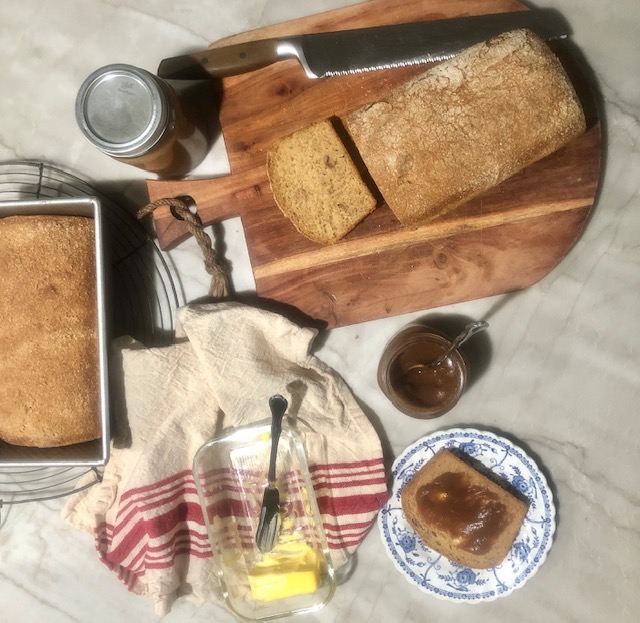
This screenshot has height=623, width=640. I want to click on plate, so click(x=464, y=584).